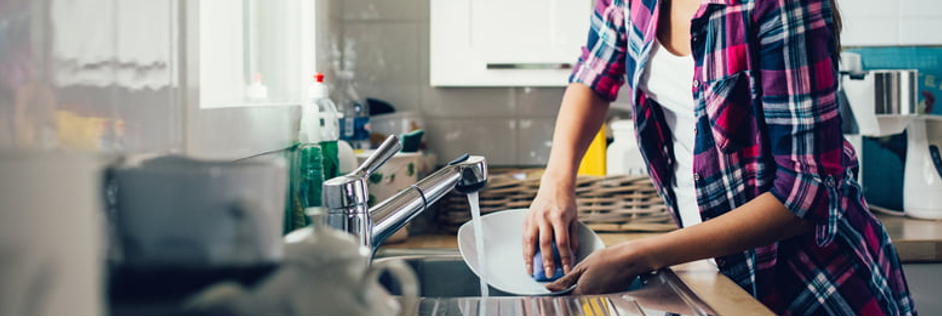
Where is `dishwashing liquid`? The image size is (942, 319). dishwashing liquid is located at coordinates (325, 153).